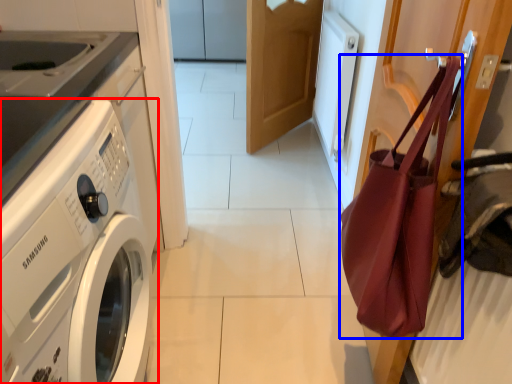
Question: Which point is closer to the camera, washing machine (highlighted by a red box) or tote bag (highlighted by a blue box)?

Choices:
 (A) washing machine
 (B) tote bag

Answer: (A)